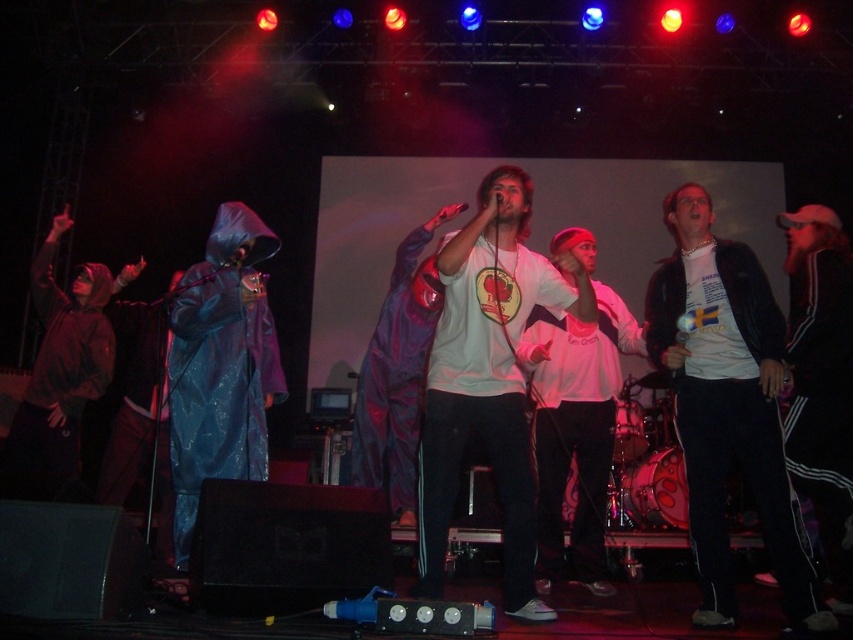
Between white matte hoodie at center and matte blue raincoat at left, which one is positioned higher?

Positioned higher is matte blue raincoat at left.

Based on the photo, does white matte hoodie at center lie behind matte blue raincoat at left?

No.

Who is more distant from viewer, (585, 560) or (38, 429)?

The point (38, 429) is behind.

At what (x,y) coordinates should I click in order to perform the action: click on white matte hoodie at center. Please return your answer as a coordinate pair (x, y). Looking at the image, I should click on (575, 417).

Who is taller, matte blue raincoat at left or shiny purple raincoat at center?

With more height is shiny purple raincoat at center.

Can you confirm if matte blue raincoat at left is thinner than shiny purple raincoat at center?

Yes.

Is point (35, 396) less distant than point (389, 310)?

Yes, point (35, 396) is in front of point (389, 310).

Locate an element on the screen. This screenshot has height=640, width=853. matte blue raincoat at left is located at coordinates (59, 378).

Can you confirm if blue shiny raincoat at left is shorter than shiny purple raincoat at center?

Correct, blue shiny raincoat at left is not as tall as shiny purple raincoat at center.

Who is more distant from viewer, (x=189, y=387) or (x=387, y=364)?

Positioned behind is point (x=387, y=364).

Image resolution: width=853 pixels, height=640 pixels. Find the location of `blue shiny raincoat at left`. blue shiny raincoat at left is located at coordinates (219, 365).